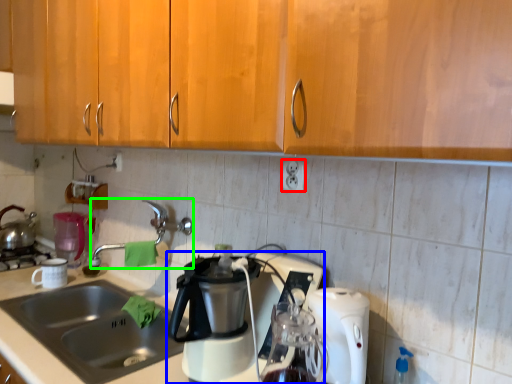
Question: Estimate the real-world distances between objects in this image. Which object is closer to electric outlet (highlighted by a red box), coffee maker (highlighted by a blue box) or faucet (highlighted by a green box)?

Choices:
 (A) coffee maker
 (B) faucet

Answer: (A)